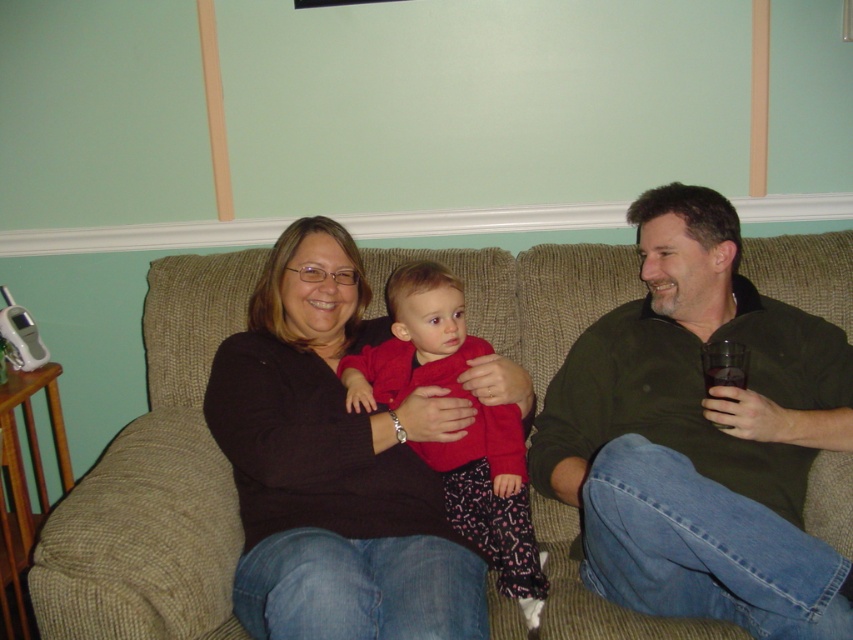
Between green cotton shirt at right and matte red sweater at center, which one appears on the left side from the viewer's perspective?

From the viewer's perspective, matte red sweater at center appears more on the left side.

Is green cotton shirt at right positioned before matte red sweater at center?

Yes, green cotton shirt at right is closer to the viewer.

Is point (759, 461) positioned in front of point (459, 493)?

Yes.

Locate an element on the screen. The image size is (853, 640). green cotton shirt at right is located at coordinates (700, 436).

Looking at this image, is textured beige couch at center above matte red sweater at center?

Indeed, textured beige couch at center is positioned over matte red sweater at center.

Is textured beige couch at center in front of matte red sweater at center?

→ Yes, it is.

You are a GUI agent. You are given a task and a screenshot of the screen. Output one action in this format:
    pyautogui.click(x=<x>, y=<y>)
    Task: Click on the textured beige couch at center
    
    Given the screenshot: What is the action you would take?
    pyautogui.click(x=155, y=483)

Can you confirm if green cotton shirt at right is smaller than textured beige couch at center?

No.

Which is more to the right, green cotton shirt at right or textured beige couch at center?

From the viewer's perspective, green cotton shirt at right appears more on the right side.

This screenshot has height=640, width=853. I want to click on green cotton shirt at right, so [x=700, y=436].